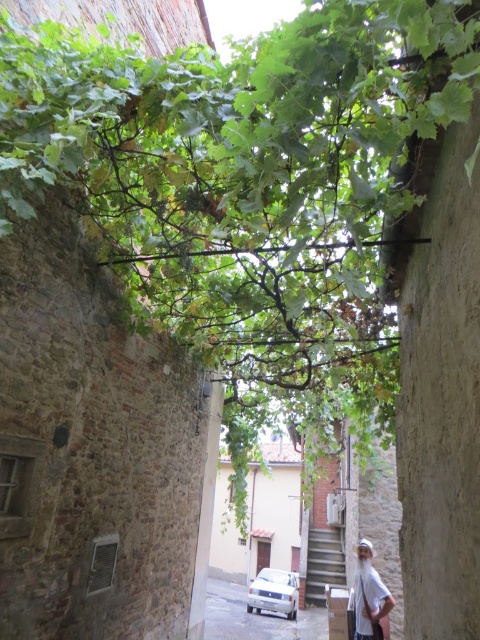
You are a delivery person carrying a large package that is 10 feet long. You are standing at the entrance of the alleyway and see the white cotton shirt at lower right. Can you determine if your package will fit through the alleyway to reach the shirt?

The white cotton shirt at lower right is 16.67 feet away from the camera, so the 10 feet long package can fit through the alleyway since the distance is sufficient.

You are a delivery person carrying a package and need to navigate through the narrow alleyway. You see a white cotton shirt at lower right. Where exactly is the white cotton shirt located in the alleyway?

The white cotton shirt at lower right is located at point (369, 595) in the alleyway.